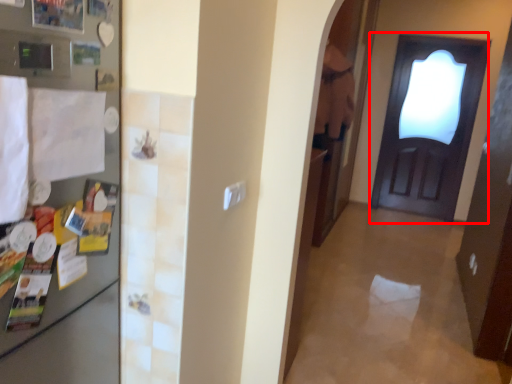
Question: Observing the image, what is the correct spatial positioning of door (annotated by the red box) in reference to fridge?

Choices:
 (A) left
 (B) right

Answer: (B)